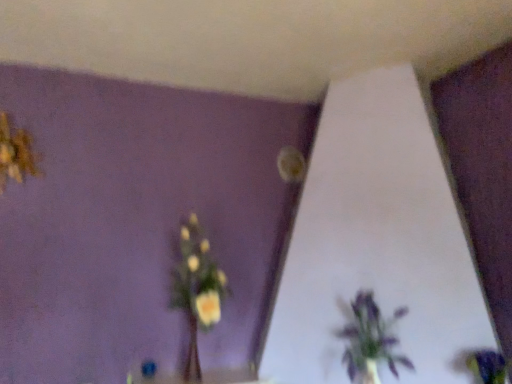
Question: Does yellow fabric flower at upper left, which is counted as the 3th flower, starting from the right, have a greater height compared to purple matte flower at lower right, the first flower in the front-to-back sequence?

Choices:
 (A) no
 (B) yes

Answer: (B)

Question: Considering the relative sizes of yellow fabric flower at upper left, which is counted as the 3th flower, starting from the right, and purple matte flower at lower right, the first flower in the front-to-back sequence, in the image provided, is yellow fabric flower at upper left, which is counted as the 3th flower, starting from the right, thinner than purple matte flower at lower right, the first flower in the front-to-back sequence,?

Choices:
 (A) no
 (B) yes

Answer: (B)

Question: Are yellow fabric flower at upper left, which is counted as the 3th flower, starting from the right, and purple matte flower at lower right, positioned as the third flower in left-to-right order, far apart?

Choices:
 (A) no
 (B) yes

Answer: (B)

Question: Is yellow fabric flower at upper left, which is the first flower from left to right, touching purple matte flower at lower right, the 3th flower viewed from the back?

Choices:
 (A) no
 (B) yes

Answer: (A)

Question: Considering the relative sizes of yellow fabric flower at upper left, which appears as the third flower when ordered from the bottom, and purple matte flower at lower right, arranged as the 1th flower when ordered from the bottom, in the image provided, is yellow fabric flower at upper left, which appears as the third flower when ordered from the bottom, wider than purple matte flower at lower right, arranged as the 1th flower when ordered from the bottom,?

Choices:
 (A) no
 (B) yes

Answer: (A)

Question: From a real-world perspective, is yellow matte vase at center physically located above or below matte yellow flower at upper center, the second flower viewed from the right?

Choices:
 (A) below
 (B) above

Answer: (A)

Question: Is yellow matte vase at center inside or outside of matte yellow flower at upper center, the second flower viewed from the right?

Choices:
 (A) inside
 (B) outside

Answer: (B)

Question: Looking at their shapes, would you say yellow matte vase at center is wider or thinner than matte yellow flower at upper center, the second flower in the bottom-to-top sequence?

Choices:
 (A) thin
 (B) wide

Answer: (B)

Question: From the image's perspective, is yellow matte vase at center positioned above or below matte yellow flower at upper center, the third flower from the front?

Choices:
 (A) below
 (B) above

Answer: (A)

Question: Considering the positions of yellow fabric flower at upper left, which appears as the third flower when ordered from the bottom, and yellow matte vase at center in the image, is yellow fabric flower at upper left, which appears as the third flower when ordered from the bottom, wider or thinner than yellow matte vase at center?

Choices:
 (A) wide
 (B) thin

Answer: (B)

Question: Does point (20, 137) appear closer or farther from the camera than point (186, 365)?

Choices:
 (A) closer
 (B) farther

Answer: (A)

Question: Would you say yellow fabric flower at upper left, which appears as the third flower when ordered from the bottom, is inside or outside yellow matte vase at center?

Choices:
 (A) outside
 (B) inside

Answer: (A)

Question: Would you say yellow fabric flower at upper left, which is the first flower from left to right, is to the left or to the right of yellow matte vase at center in the picture?

Choices:
 (A) left
 (B) right

Answer: (A)

Question: Is purple matte flower at lower right, the 1th flower viewed from the right, taller or shorter than yellow fabric flower at upper left, which is the first flower from left to right?

Choices:
 (A) short
 (B) tall

Answer: (A)

Question: Considering the relative positions of purple matte flower at lower right, arranged as the 1th flower when ordered from the bottom, and yellow fabric flower at upper left, the 2th flower when ordered from back to front, in the image provided, is purple matte flower at lower right, arranged as the 1th flower when ordered from the bottom, to the left or to the right of yellow fabric flower at upper left, the 2th flower when ordered from back to front,?

Choices:
 (A) left
 (B) right

Answer: (B)